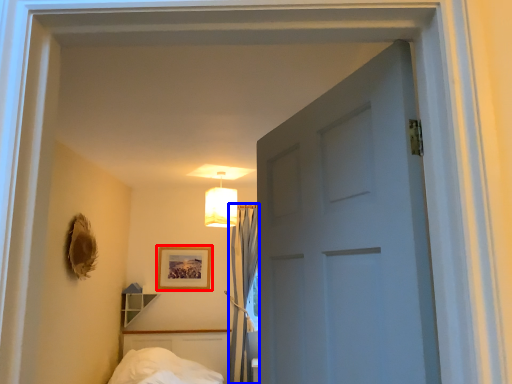
Question: Which object appears closest to the camera in this image, picture frame (highlighted by a red box) or curtain (highlighted by a blue box)?

Choices:
 (A) picture frame
 (B) curtain

Answer: (B)